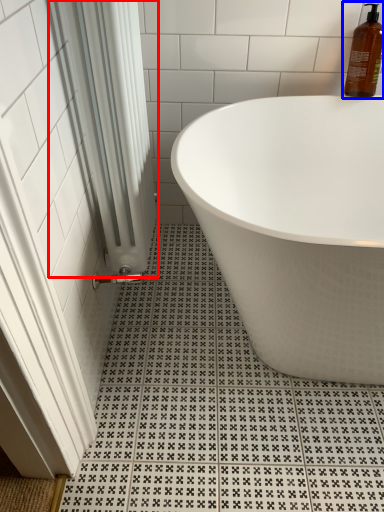
Question: Which of the following is the closest to the observer, shower curtain (highlighted by a red box) or cleaning product (highlighted by a blue box)?

Choices:
 (A) shower curtain
 (B) cleaning product

Answer: (A)